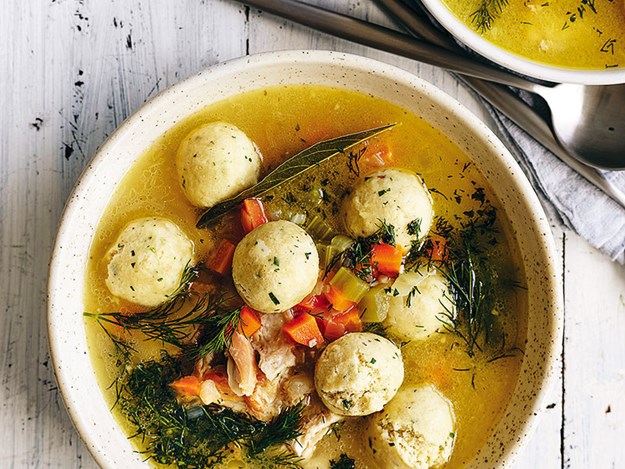
This screenshot has width=625, height=469. Identify the location of spoon bowl. (582, 139), (609, 101), (617, 138).